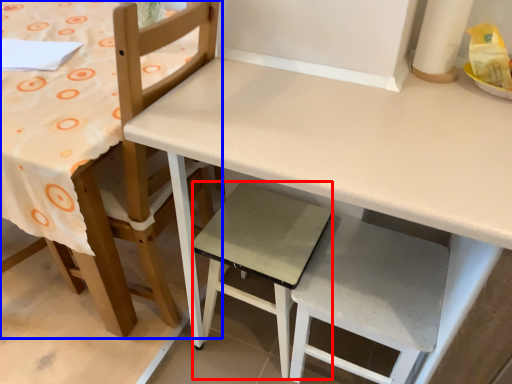
Question: Which object appears farthest to the camera in this image, step stool (highlighted by a red box) or chair (highlighted by a blue box)?

Choices:
 (A) step stool
 (B) chair

Answer: (A)